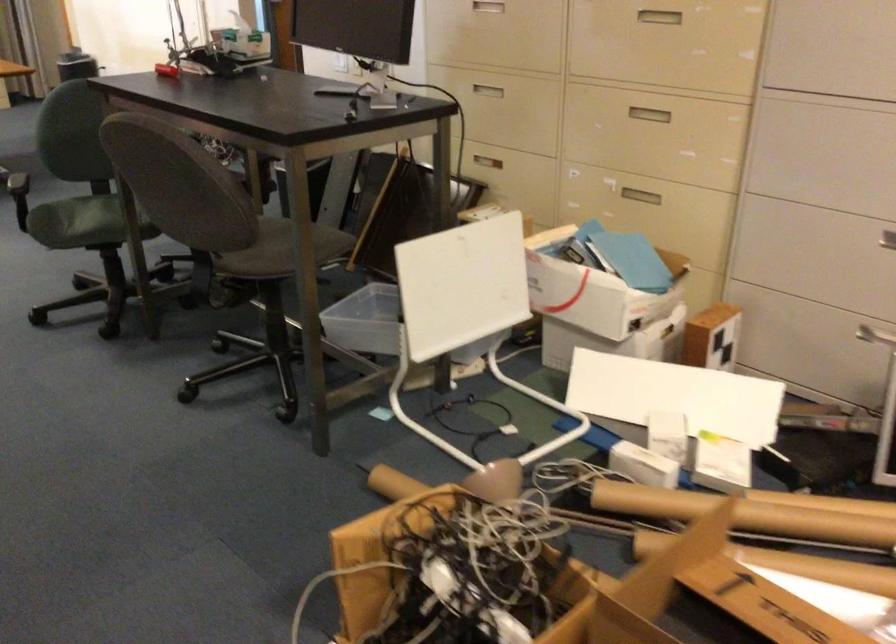
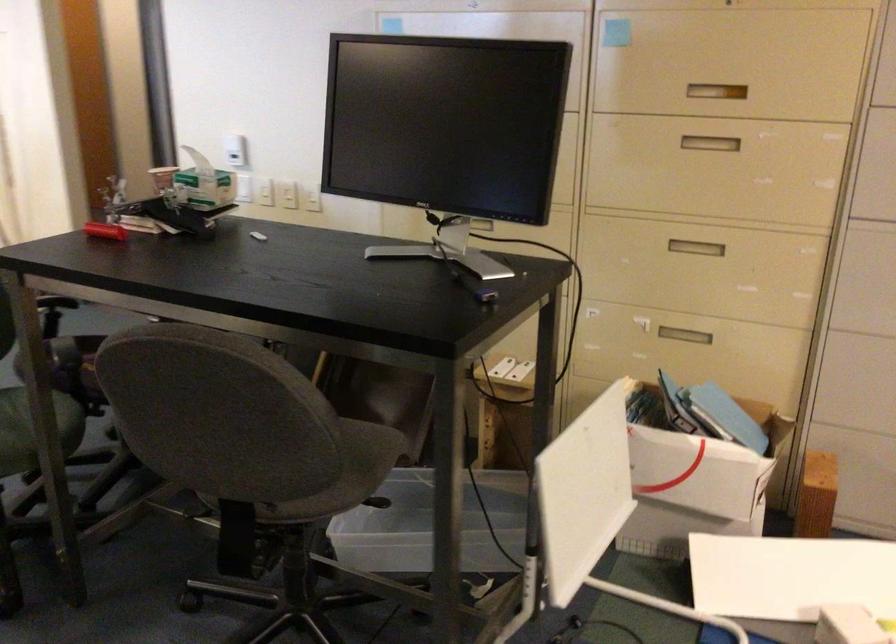
Find the pixel in the second image that matches (x=313, y=247) in the first image.

(364, 462)